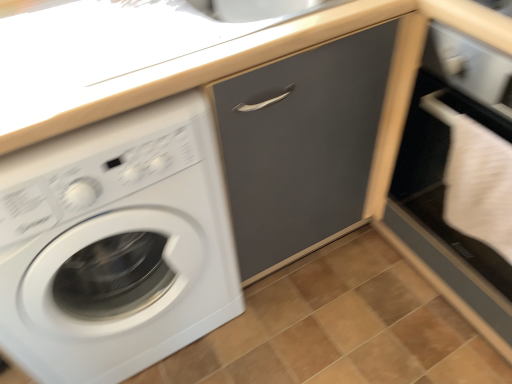
Question: From a real-world perspective, is matte gray drawer at center physically above brown wooden tile at lower center?

Choices:
 (A) yes
 (B) no

Answer: (A)

Question: Is matte gray drawer at center wider than brown wooden tile at lower center?

Choices:
 (A) yes
 (B) no

Answer: (B)

Question: From a real-world perspective, is matte gray drawer at center located beneath brown wooden tile at lower center?

Choices:
 (A) no
 (B) yes

Answer: (A)

Question: Would you say matte gray drawer at center contains brown wooden tile at lower center?

Choices:
 (A) yes
 (B) no

Answer: (B)

Question: Can you confirm if matte gray drawer at center is positioned to the left of brown wooden tile at lower center?

Choices:
 (A) yes
 (B) no

Answer: (A)

Question: Is matte gray drawer at center oriented away from brown wooden tile at lower center?

Choices:
 (A) yes
 (B) no

Answer: (B)

Question: Is brown wooden tile at lower center next to white glossy washing machine at left?

Choices:
 (A) no
 (B) yes

Answer: (A)

Question: From the image's perspective, is brown wooden tile at lower center located beneath white glossy washing machine at left?

Choices:
 (A) no
 (B) yes

Answer: (B)

Question: From a real-world perspective, is brown wooden tile at lower center located beneath white glossy washing machine at left?

Choices:
 (A) no
 (B) yes

Answer: (B)

Question: Is brown wooden tile at lower center positioned in front of white glossy washing machine at left?

Choices:
 (A) no
 (B) yes

Answer: (A)

Question: Is brown wooden tile at lower center at the right side of white glossy washing machine at left?

Choices:
 (A) yes
 (B) no

Answer: (A)

Question: Would you say white glossy washing machine at left is part of brown wooden tile at lower center's contents?

Choices:
 (A) yes
 (B) no

Answer: (B)

Question: Is matte gray drawer at center in contact with white matte file cabinet at lower right?

Choices:
 (A) no
 (B) yes

Answer: (A)